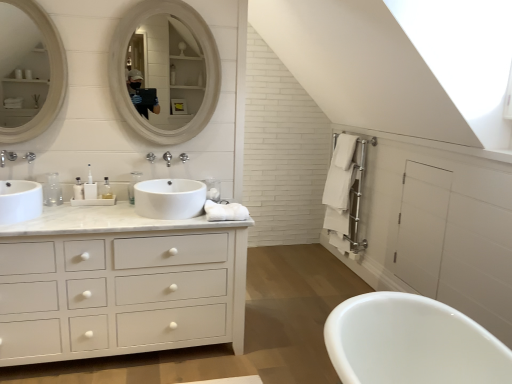
Question: Considering their positions, is white plastic soap dispenser at center located in front of or behind white glossy sink at center, positioned as the 1th sink in right-to-left order?

Choices:
 (A) front
 (B) behind

Answer: (B)

Question: Considering the positions of white plastic soap dispenser at center and white glossy sink at center, positioned as the 1th sink in right-to-left order, in the image, is white plastic soap dispenser at center taller or shorter than white glossy sink at center, positioned as the 1th sink in right-to-left order,?

Choices:
 (A) tall
 (B) short

Answer: (A)

Question: Estimate the real-world distances between objects in this image. Which object is farther from the brushed metal faucet at left?

Choices:
 (A) clear plastic bottle at center, which ranks as the 2th toiletry in right-to-left order
 (B) white glossy sink at center, arranged as the second sink when viewed from the left
 (C) white glossy sink at left, the first sink from the left
 (D) white plastic soap dispenser at center
 (E) white matte cabinet at left

Answer: (E)

Question: Which object is positioned closest to the white glossy sink at left, positioned as the second sink in right-to-left order?

Choices:
 (A) white glossy bathtub at lower right
 (B) matte silver faucet at left, which appears as the 1th faucet when viewed from the front
 (C) white glossy mirror at upper center, the second mirror when ordered from left to right
 (D) clear plastic bottle at center, the first toiletry when ordered from right to left
 (E) white wooden mirror at upper left, the 1th mirror viewed from the left

Answer: (B)